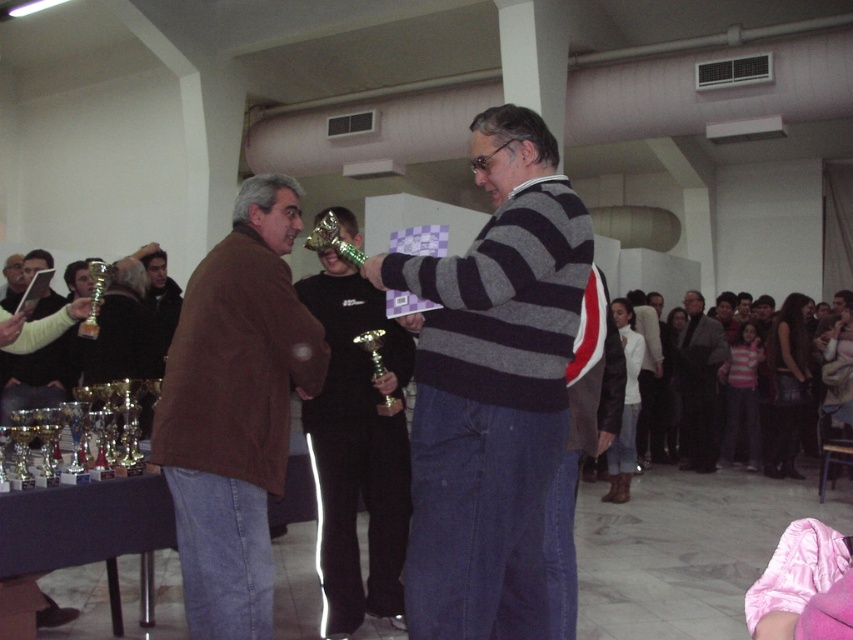
You are standing in the event hall and want to determine which of the two points, point (289, 189) or point (688, 368), is nearer to you. Based on the scene description, can you identify the closer point?

Point (289, 189) is closer to the viewer than point (688, 368).

You are planning to place a 15 feet long banner between the brown leather jacket at left and the dark gray wool sweater at center. Is there enough space to place the banner without moving any of them?

The distance between the brown leather jacket at left and the dark gray wool sweater at center is 19.42 feet, which is greater than the 15 feet length of the banner. Therefore, there is enough space to place the banner between them without moving either object.

You are a photographer standing 3 feet away from the striped sweater at center and brown leather jacket at left. You want to capture a photo where both subjects are in focus. Given that your camera has a depth of field that can sharply focus objects within a 20 inch range, will both subjects be in focus?

The striped sweater at center and brown leather jacket at left are 21.61 inches apart from each other. Since the distance between them exceeds the camera lens depth of field range of 20 inches, it is likely that both subjects cannot be in focus simultaneously.